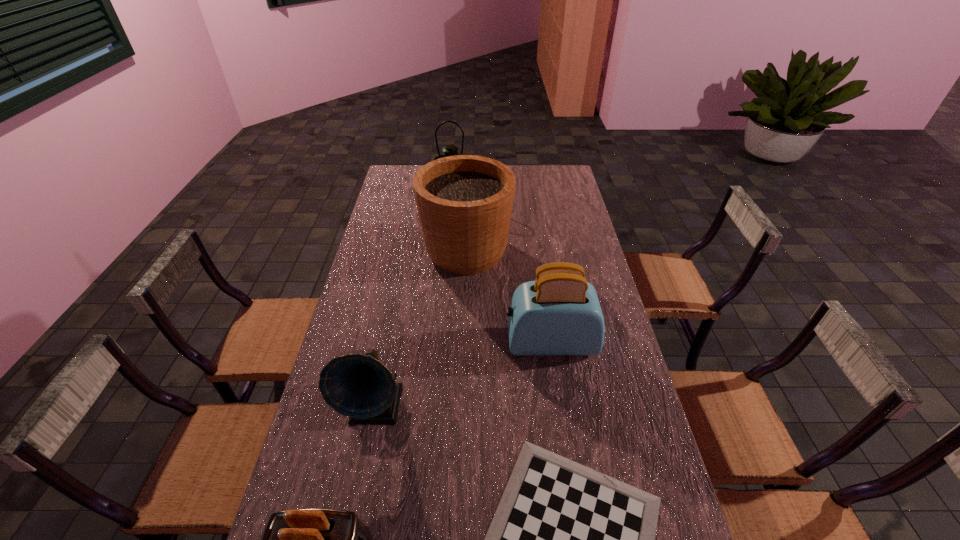
The image size is (960, 540). I want to click on vacant area located from the horn of the phonograph_record, so click(x=350, y=536).

Locate an element on the screen. The width and height of the screenshot is (960, 540). object positioned at the far edge is located at coordinates (449, 150).

Locate an element on the screen. The height and width of the screenshot is (540, 960). object at the left edge is located at coordinates (360, 387).

Find the location of a particular element. object that is at the right edge is located at coordinates (559, 313).

Find the location of a particular element. The image size is (960, 540). vacant space at the left edge of the desktop is located at coordinates (377, 240).

Find the location of `vacant space at the right edge of the desktop`. vacant space at the right edge of the desktop is located at coordinates (594, 372).

In the image, there is a desktop. Where is `vacant region at the far right corner`? Image resolution: width=960 pixels, height=540 pixels. vacant region at the far right corner is located at coordinates (544, 180).

What are the coordinates of `empty space that is in between the phonograph_record and the taller toaster` in the screenshot? It's located at 463,375.

Locate an element on the screen. The width and height of the screenshot is (960, 540). free space that is in between the phonograph_record and the lantern is located at coordinates (414, 301).

Find the location of `free space between the flowerpot and the right toaster`. free space between the flowerpot and the right toaster is located at coordinates (508, 297).